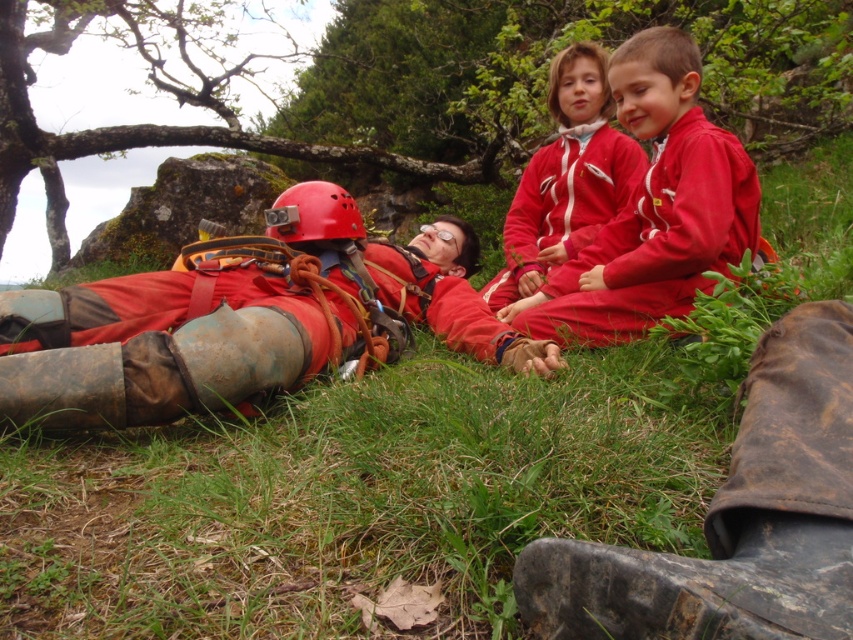
Question: Observing the image, what is the correct spatial positioning of matte red jacket at upper right in reference to red matte helmet at center?

Choices:
 (A) left
 (B) right

Answer: (B)

Question: Does matte red tracksuit at center have a smaller size compared to red matte helmet at center?

Choices:
 (A) no
 (B) yes

Answer: (A)

Question: Which of these objects is positioned closest to the matte red jacket at upper right?

Choices:
 (A) matte red tracksuit at center
 (B) red matte helmet at center

Answer: (A)

Question: Is matte red tracksuit at center thinner than matte red jacket at upper right?

Choices:
 (A) yes
 (B) no

Answer: (B)

Question: Which object appears closest to the camera in this image?

Choices:
 (A) matte red jacket at upper right
 (B) red matte helmet at center

Answer: (B)

Question: Which object is positioned farthest from the matte red tracksuit at center?

Choices:
 (A) red matte helmet at center
 (B) matte red jacket at upper right

Answer: (A)